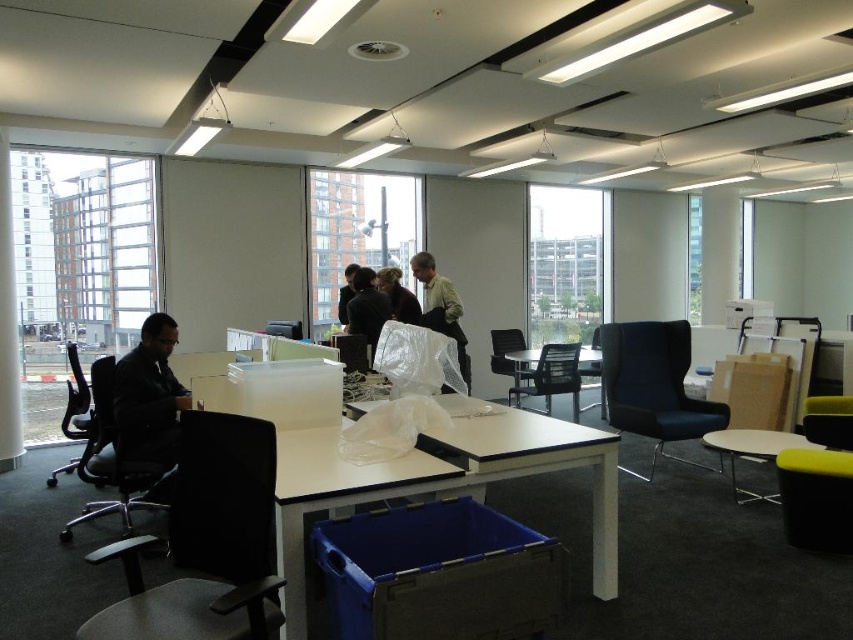
Question: Can you confirm if light brown fabric shirt at center is wider than black mesh office chair at left?

Choices:
 (A) no
 (B) yes

Answer: (A)

Question: Does dark blue fabric chair at center have a smaller size compared to matte black chair at center?

Choices:
 (A) no
 (B) yes

Answer: (A)

Question: Which object is farther from the camera taking this photo?

Choices:
 (A) white glossy table at lower right
 (B) light brown fabric shirt at center
 (C) matte black chair at center
 (D) dark blue fabric chair at center

Answer: (C)

Question: Which point is farther to the camera?

Choices:
 (A) (390, 280)
 (B) (109, 460)
 (C) (349, 305)

Answer: (A)

Question: Among these objects, which one is farthest from the camera?

Choices:
 (A) black mesh chair at center
 (B) dark blue fabric chair at center

Answer: (A)

Question: Considering the relative positions of dark blue fabric chair at center and black leather chair at left in the image provided, where is dark blue fabric chair at center located with respect to black leather chair at left?

Choices:
 (A) below
 (B) above

Answer: (B)